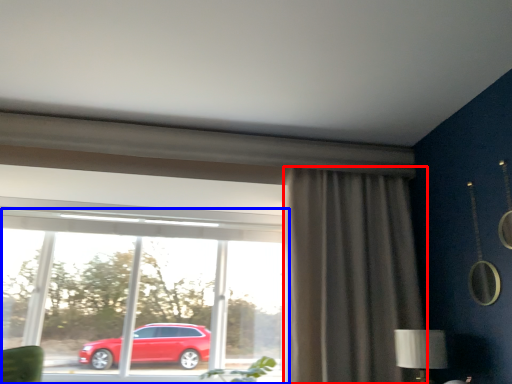
Question: Among these objects, which one is farthest to the camera, curtain (highlighted by a red box) or window (highlighted by a blue box)?

Choices:
 (A) curtain
 (B) window

Answer: (B)